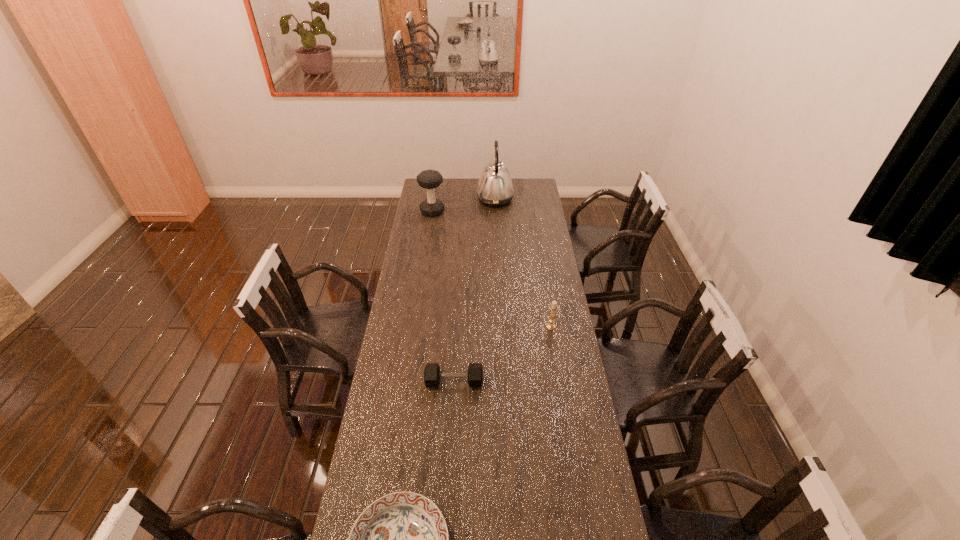
At what (x,y) coordinates should I click in order to perform the action: click on kettle. Please return your answer as a coordinate pair (x, y). The image size is (960, 540). Looking at the image, I should click on (495, 188).

What are the coordinates of `the taller dumbbell` in the screenshot? It's located at (430, 179).

Where is `the second tallest object`? This screenshot has width=960, height=540. the second tallest object is located at coordinates (430, 179).

Find the location of a particular element. This screenshot has height=540, width=960. the third nearest object is located at coordinates (553, 307).

Identify the location of the third shortest object. (553, 307).

Identify the location of the second shortest object. The width and height of the screenshot is (960, 540). (432, 374).

I want to click on the nearer dumbbell, so click(432, 374).

The image size is (960, 540). I want to click on vacant space located from the spout of the tallest object, so click(450, 199).

Where is `free space located 0.140m from the spout of the tallest object`? Image resolution: width=960 pixels, height=540 pixels. free space located 0.140m from the spout of the tallest object is located at coordinates (452, 199).

What are the coordinates of `free spot located from the spout of the tallest object` in the screenshot? It's located at (430, 199).